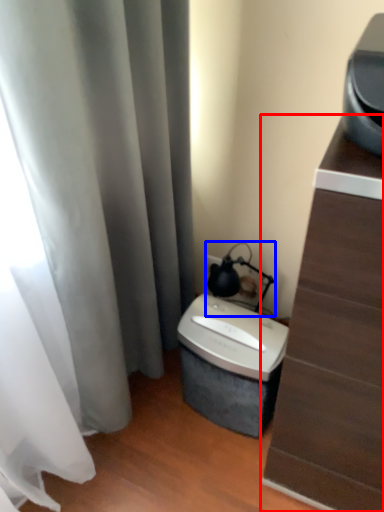
Question: Which object appears farthest to the camera in this image, furniture (highlighted by a red box) or table lamp (highlighted by a blue box)?

Choices:
 (A) furniture
 (B) table lamp

Answer: (B)